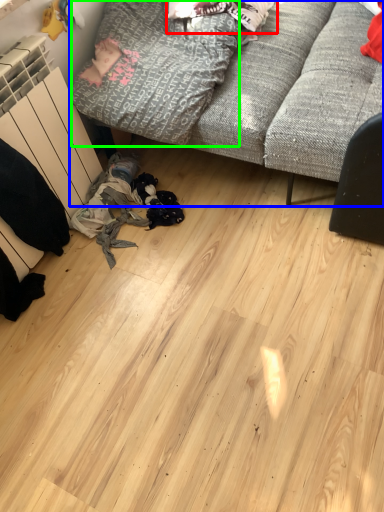
Question: Which object is positioned farthest from clothing (highlighted by a red box)? Select from studio couch (highlighted by a blue box) and clothing (highlighted by a green box).

Choices:
 (A) studio couch
 (B) clothing

Answer: (A)